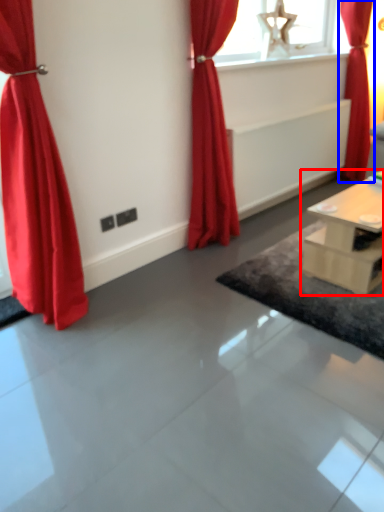
Question: Which object is closer to the camera taking this photo, table (highlighted by a red box) or curtain (highlighted by a blue box)?

Choices:
 (A) table
 (B) curtain

Answer: (A)